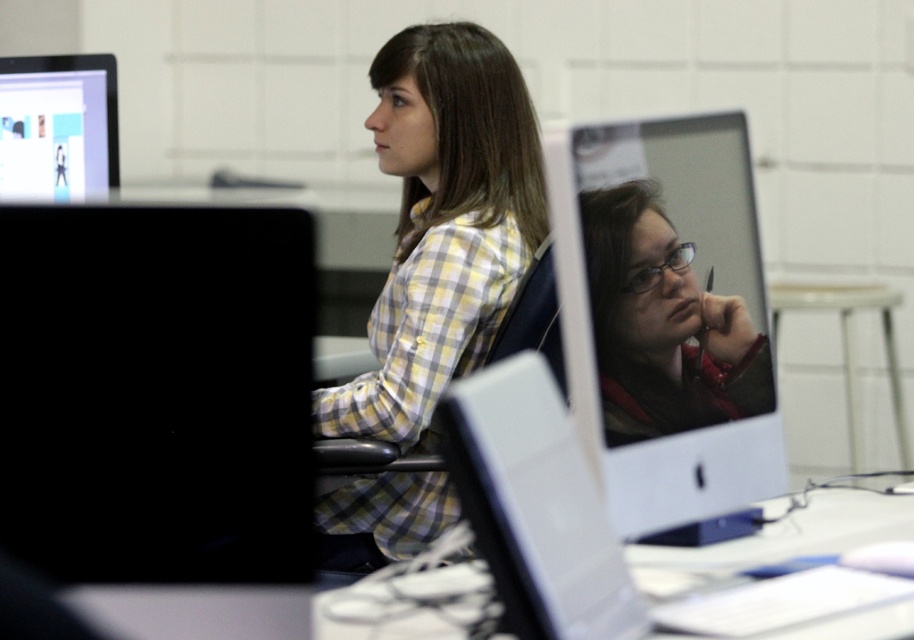
Question: Which object appears closest to the camera in this image?

Choices:
 (A) matte black monitor at center
 (B) yellow plaid shirt at center

Answer: (A)

Question: Does black matte monitor at left appear on the left side of yellow plaid shirt at center?

Choices:
 (A) yes
 (B) no

Answer: (A)

Question: Can you confirm if black matte monitor at left is positioned above matte black monitor at center?

Choices:
 (A) no
 (B) yes

Answer: (A)

Question: Is black matte monitor at left positioned at the back of white glossy table at center?

Choices:
 (A) no
 (B) yes

Answer: (A)

Question: Which object is positioned closest to the yellow plaid shirt at center?

Choices:
 (A) black matte monitor at left
 (B) matte black monitor at center
 (C) white glossy table at center

Answer: (B)

Question: Which of the following is the closest to the observer?

Choices:
 (A) matte black monitor at center
 (B) white glossy table at center
 (C) black matte monitor at left

Answer: (C)